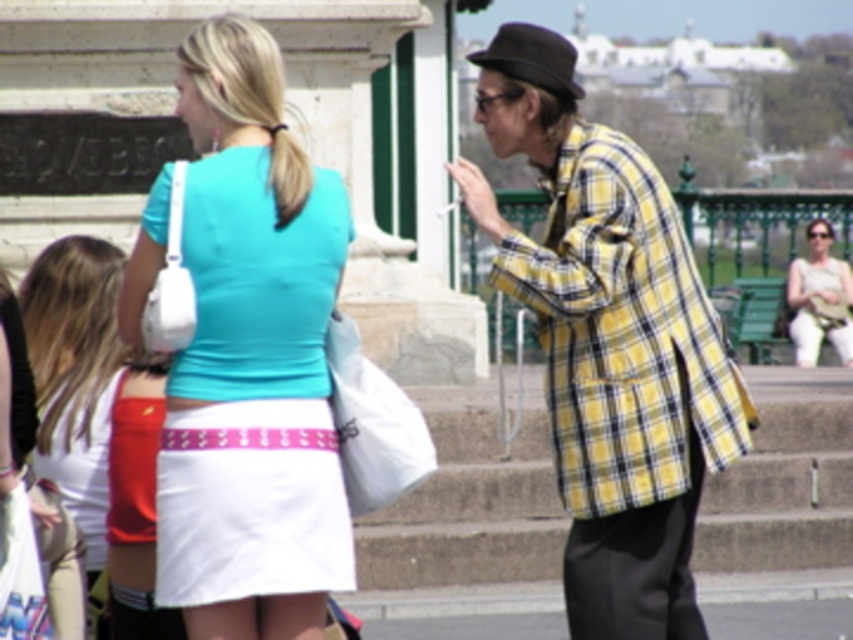
You are standing at the point with coordinates point (672, 330) and want to walk to point (842, 337). Which direction should you move in to get closer to your destination?

You should move upwards because point (842, 337) is further away from the viewer compared to point (672, 330).

You are standing at the camera position and want to throw a paper airplane to the person wearing the matte teal blouse at center. If the maximum throwing distance you can achieve is 40 meters, will you be able to reach them?

The distance between the matte teal blouse at center and the camera is 45.69 meters. Since your maximum throwing distance is 40 meters, you cannot reach them with a paper airplane.

You are organizing a charity event and need to place a large donation box in the scene. The box must be placed where the yellow plaid jacket at center and the white fabric purse at right are currently located. Since the donation box is bigger than both items, which location should you choose to ensure it fits without overlapping?

The yellow plaid jacket at center is larger in size than the white fabric purse at right, so placing the donation box where the yellow plaid jacket at center is located would be more suitable as it can accommodate the larger size of the donation box without overlapping.